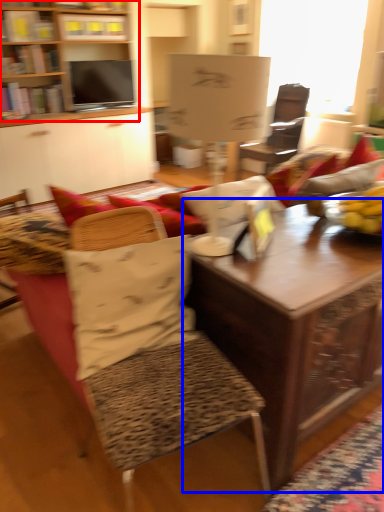
Question: Among these objects, which one is nearest to the camera, bookcase (highlighted by a red box) or table (highlighted by a blue box)?

Choices:
 (A) bookcase
 (B) table

Answer: (B)